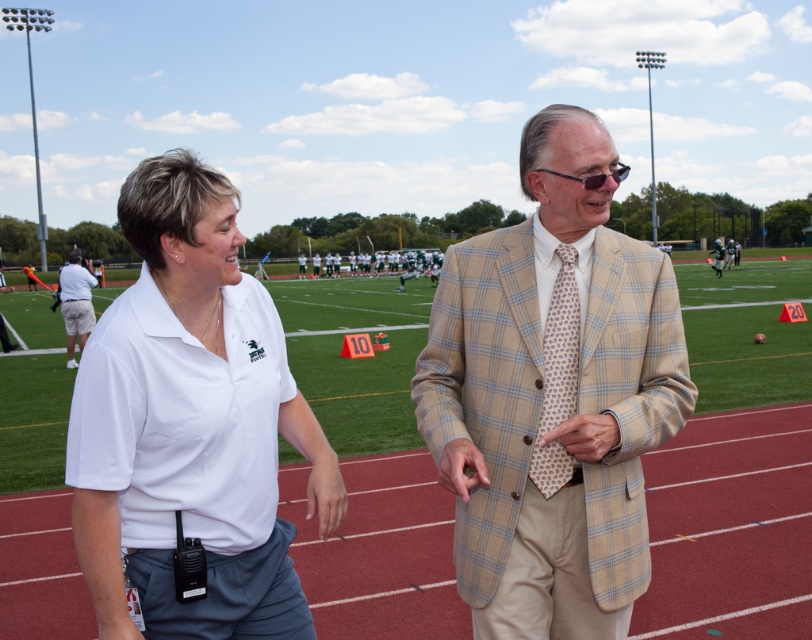
Between white cotton polo shirt at center and khaki shorts at left, which one has more height?

khaki shorts at left

Can you confirm if white cotton polo shirt at center is bigger than khaki shorts at left?

Actually, white cotton polo shirt at center might be smaller than khaki shorts at left.

Is point (84, 380) in front of point (70, 324)?

Yes, point (84, 380) is closer to viewer.

Find the location of `white cotton polo shirt at center`. white cotton polo shirt at center is located at coordinates (189, 426).

Who is positioned more to the right, beige plaid suit at center or plaid beige blazer at center?

From the viewer's perspective, plaid beige blazer at center appears more on the right side.

Is beige plaid suit at center wider than plaid beige blazer at center?

In fact, beige plaid suit at center might be narrower than plaid beige blazer at center.

Describe the element at coordinates (551, 396) in the screenshot. I see `beige plaid suit at center` at that location.

Locate an element on the screen. beige plaid suit at center is located at coordinates (551, 396).

Between khaki shorts at left and plaid beige blazer at center, which one has less height?

With less height is khaki shorts at left.

The image size is (812, 640). What do you see at coordinates (76, 304) in the screenshot?
I see `khaki shorts at left` at bounding box center [76, 304].

At what (x,y) coordinates should I click in order to perform the action: click on khaki shorts at left. Please return your answer as a coordinate pair (x, y). Image resolution: width=812 pixels, height=640 pixels. Looking at the image, I should click on (76, 304).